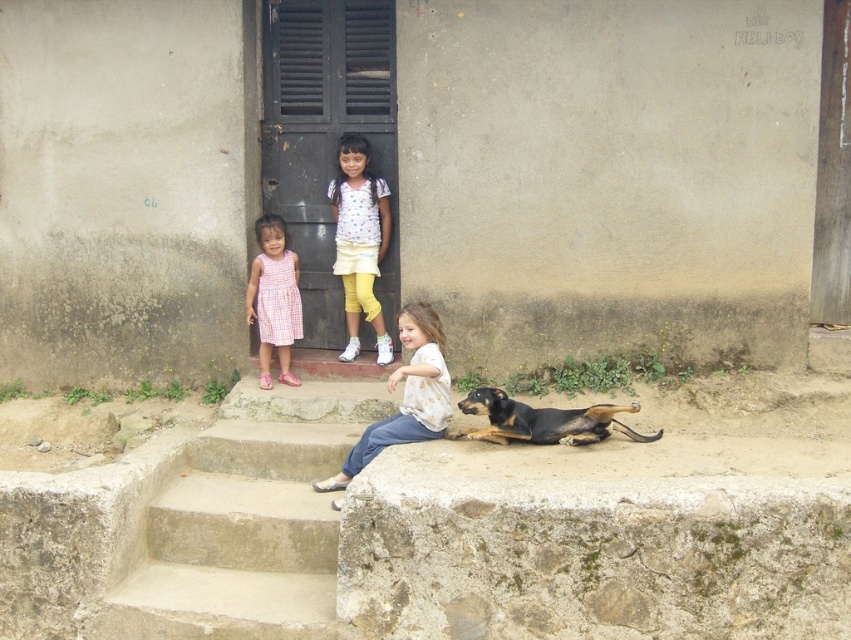
Based on the photo, can you confirm if pink checkered dress at left is positioned below black and tan fur dog at lower right?

Incorrect, pink checkered dress at left is not positioned below black and tan fur dog at lower right.

Does point (289, 336) lie in front of point (585, 432)?

No, it is not.

Is point (261, 355) farther from viewer compared to point (524, 438)?

Yes, it is behind point (524, 438).

Locate an element on the screen. This screenshot has width=851, height=640. pink checkered dress at left is located at coordinates (273, 298).

Is concrete stairs at lower center positioned before white dotted shirt at upper center?

Yes, it is in front of white dotted shirt at upper center.

Find the location of a particular element. concrete stairs at lower center is located at coordinates (247, 522).

Is concrete stairs at lower center closer to the viewer compared to pink checkered dress at left?

Yes, it is.

Describe the element at coordinates (247, 522) in the screenshot. Image resolution: width=851 pixels, height=640 pixels. I see `concrete stairs at lower center` at that location.

This screenshot has height=640, width=851. Identify the location of concrete stairs at lower center. (247, 522).